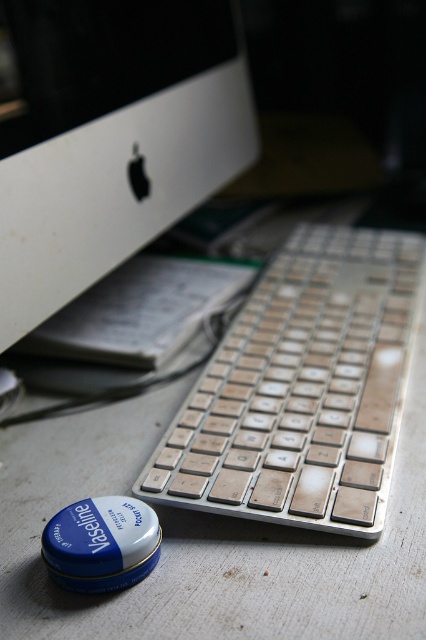
Question: Is white matte computer monitor at upper left further to camera compared to silver metallic keyboard at center?

Choices:
 (A) no
 (B) yes

Answer: (B)

Question: Is white matte computer monitor at upper left below silver metallic keyboard at center?

Choices:
 (A) no
 (B) yes

Answer: (A)

Question: Which point appears farthest from the camera in this image?

Choices:
 (A) (187, 26)
 (B) (396, 362)

Answer: (A)

Question: Does white matte computer monitor at upper left appear on the right side of silver metallic keyboard at center?

Choices:
 (A) yes
 (B) no

Answer: (B)

Question: Which point is farther to the camera?

Choices:
 (A) silver metallic keyboard at center
 (B) white matte computer monitor at upper left

Answer: (B)